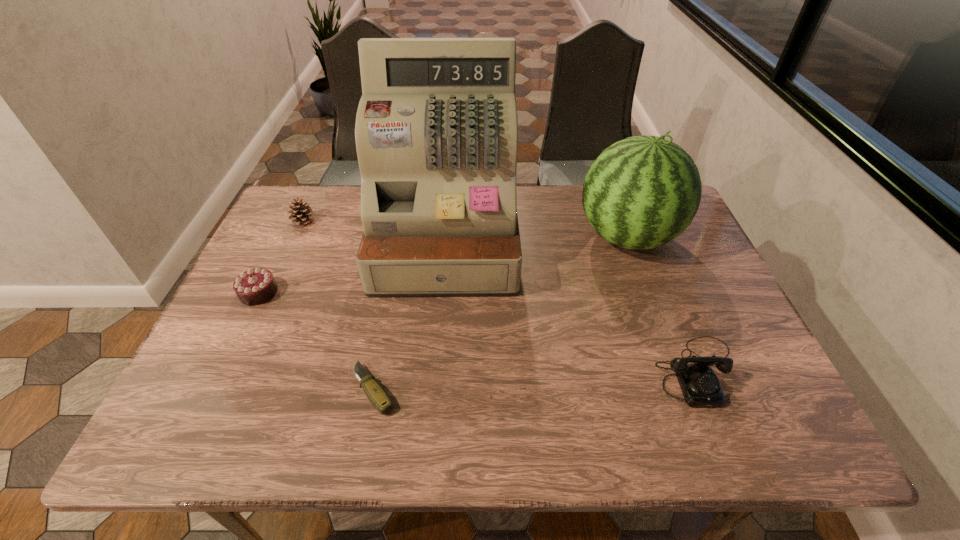
Identify the location of cash register. (436, 131).

Locate an element on the screen. This screenshot has width=960, height=540. watermelon is located at coordinates (642, 192).

Find the location of a particular element. This screenshot has width=960, height=540. pinecone is located at coordinates (302, 213).

In order to click on telephone in this screenshot , I will do `click(700, 386)`.

At what (x,y) coordinates should I click in order to perform the action: click on the fifth tallest object. Please return your answer as a coordinate pair (x, y). The height and width of the screenshot is (540, 960). Looking at the image, I should click on (255, 286).

Locate an element on the screen. the shortest object is located at coordinates (375, 393).

Where is `vacant area located 0.380m on the operating side of the cash register`? vacant area located 0.380m on the operating side of the cash register is located at coordinates (429, 444).

The image size is (960, 540). In order to click on free region located 0.320m on the front of the watermelon in this screenshot , I will do `click(678, 376)`.

Where is `vacant space positioned on the right of the pinecone`? Image resolution: width=960 pixels, height=540 pixels. vacant space positioned on the right of the pinecone is located at coordinates (400, 221).

Where is `free space located 0.080m on the back of the fifth tallest object`? This screenshot has width=960, height=540. free space located 0.080m on the back of the fifth tallest object is located at coordinates (275, 258).